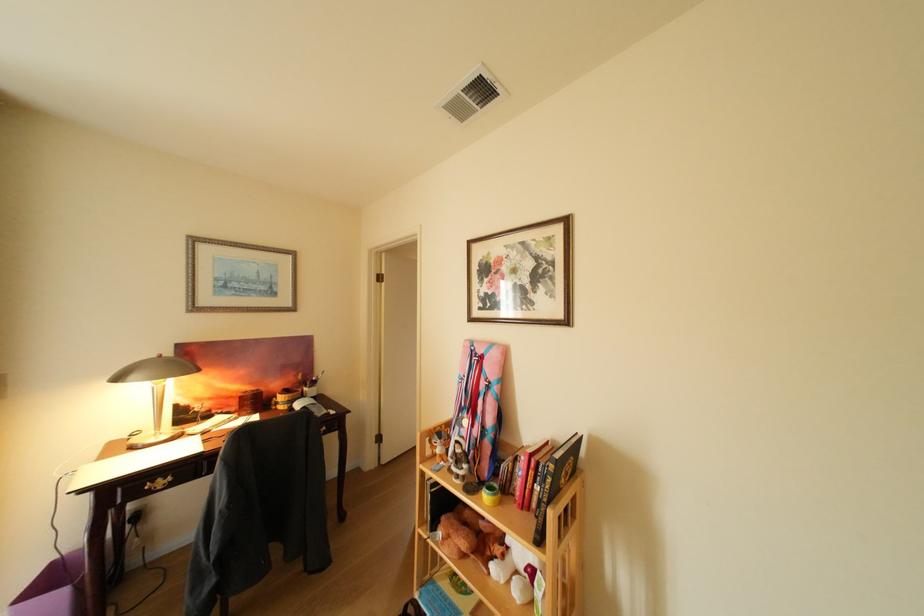
The location [526,469] corresponds to which object?

It corresponds to the red book in the image.